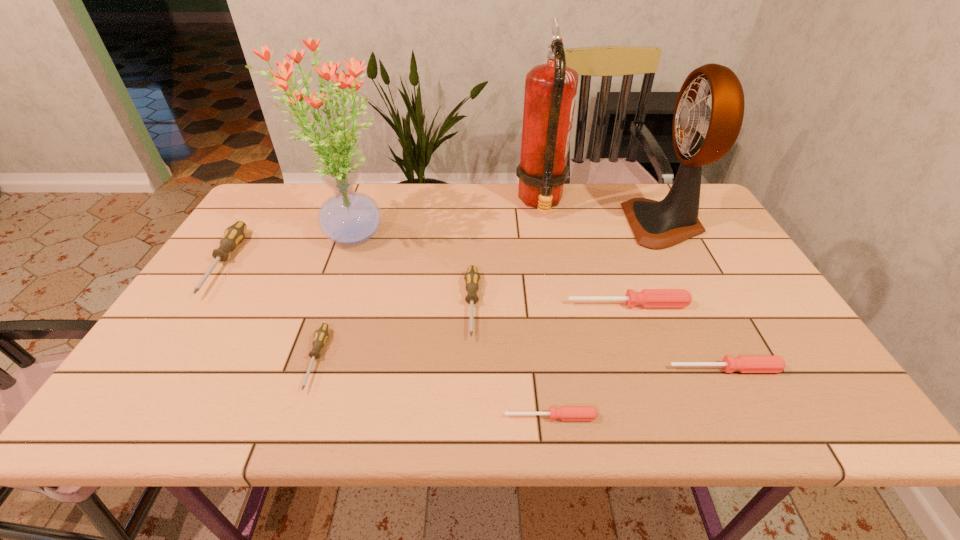
At what (x,y) coordinates should I click in order to perform the action: click on vacant space located 0.170m at the tip of the sixth shortest object. Please return your answer as a coordinate pair (x, y). Looking at the image, I should click on (162, 356).

This screenshot has height=540, width=960. What are the coordinates of `vacant point located 0.200m at the tip of the fourth object from left to right` in the screenshot? It's located at coord(469,423).

The image size is (960, 540). What are the coordinates of `free space located 0.110m on the front of the farthest red screwdriver` in the screenshot? It's located at (642, 346).

Identify the location of free space located on the back of the second smallest red screwdriver. (700, 319).

Locate an element on the screen. vacant point located on the back of the nearest red screwdriver is located at coordinates (537, 307).

Identify the location of fire extinguisher that is at the far edge. The width and height of the screenshot is (960, 540). (550, 89).

This screenshot has width=960, height=540. Identify the location of flower arrangement that is positioned at the far edge. (348, 217).

At what (x,y) coordinates should I click in order to perform the action: click on fan that is positioned at the far edge. Please return your answer as a coordinate pair (x, y). The image size is (960, 540). Looking at the image, I should click on (702, 135).

Identify the location of object that is positioned at the left edge. The height and width of the screenshot is (540, 960). (234, 234).

At what (x,y) coordinates should I click in order to perform the action: click on fan located in the right edge section of the desktop. Please return your answer as a coordinate pair (x, y). The image size is (960, 540). Looking at the image, I should click on (702, 135).